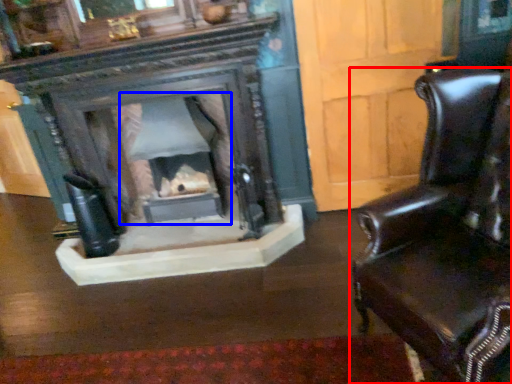
Question: Among these objects, which one is farthest to the camera, chair (highlighted by a red box) or fireplace (highlighted by a blue box)?

Choices:
 (A) chair
 (B) fireplace

Answer: (B)